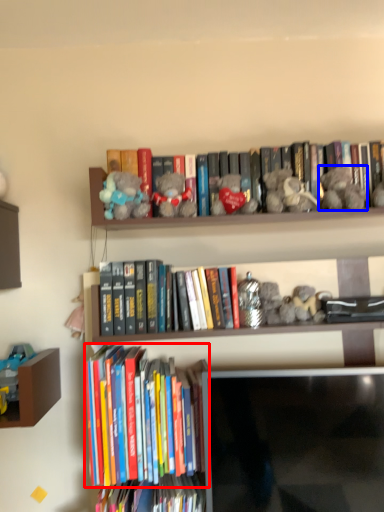
Question: Which of the following is the closest to the observer, book (highlighted by a red box) or toy (highlighted by a blue box)?

Choices:
 (A) book
 (B) toy

Answer: (A)